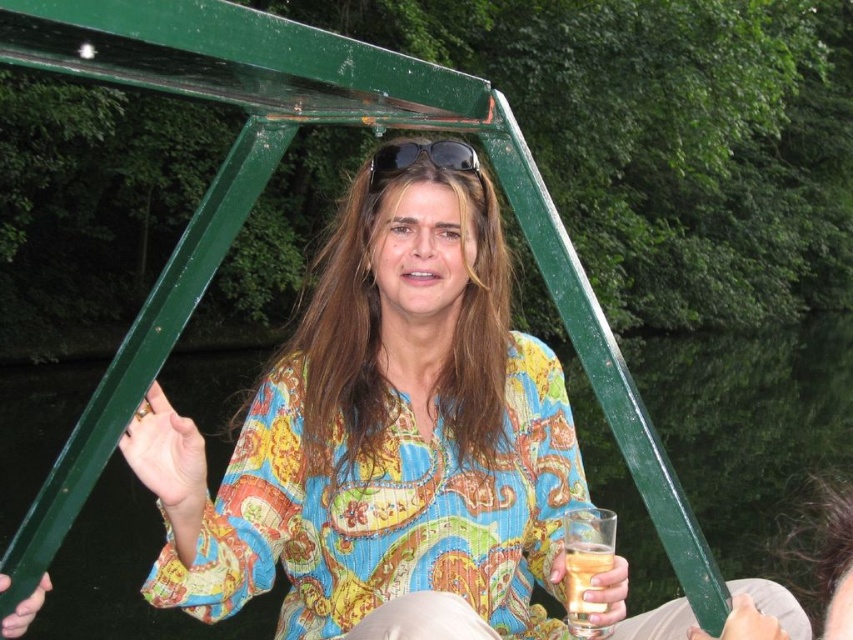
Question: Estimate the real-world distances between objects in this image. Which object is farther from the translucent glass at lower center?

Choices:
 (A) transparent glass water at center
 (B) black plastic sunglasses at upper center

Answer: (A)

Question: Where is translucent glass at lower center located in relation to black plastic sunglasses at upper center in the image?

Choices:
 (A) below
 (B) above

Answer: (A)

Question: Does transparent glass water at center come behind translucent glass at lower center?

Choices:
 (A) yes
 (B) no

Answer: (A)

Question: Which point is closer to the camera?

Choices:
 (A) (660, 422)
 (B) (473, 170)

Answer: (B)

Question: Does transparent glass water at center appear over translucent glass at lower center?

Choices:
 (A) yes
 (B) no

Answer: (B)

Question: Among these points, which one is farthest from the camera?

Choices:
 (A) (461, 145)
 (B) (604, 605)
 (C) (239, 392)

Answer: (C)